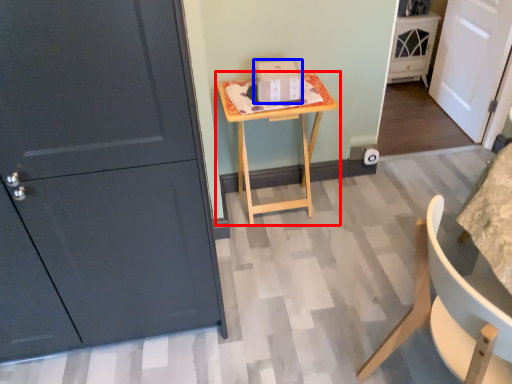
Question: Which point is closer to the camera, table (highlighted by a red box) or cardboard box (highlighted by a blue box)?

Choices:
 (A) table
 (B) cardboard box

Answer: (A)